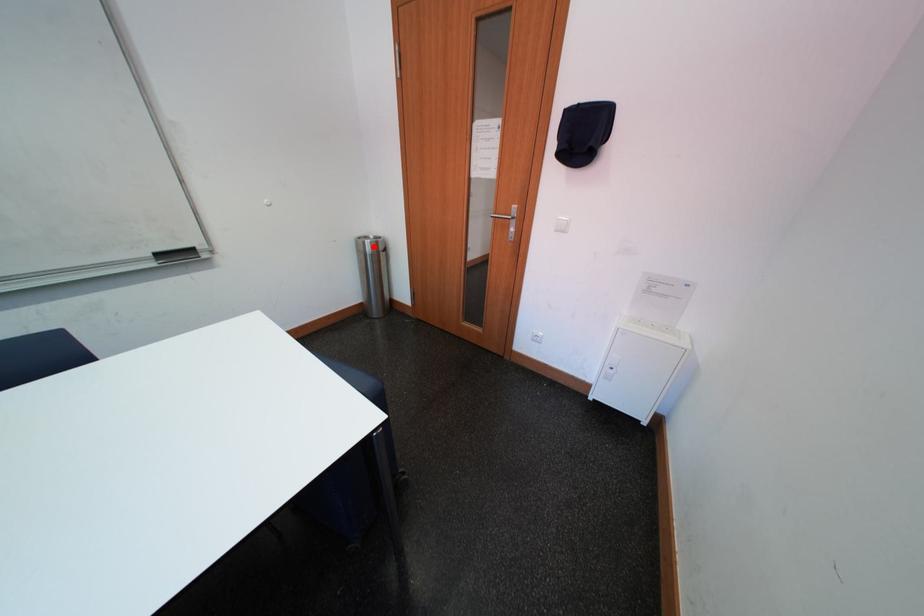
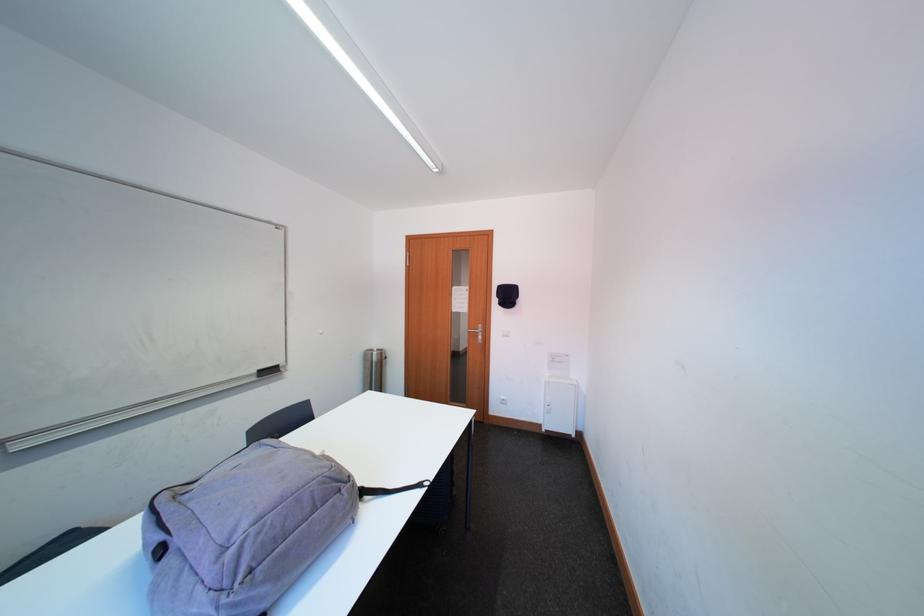
Question: I am providing you with two images of the same scene from different viewpoints. Image1 has a red point marked. In image2, the corresponding 3D location appears at what relative position? Reply with the corresponding letter.

Choices:
 (A) Closer
 (B) Farther

Answer: (B)